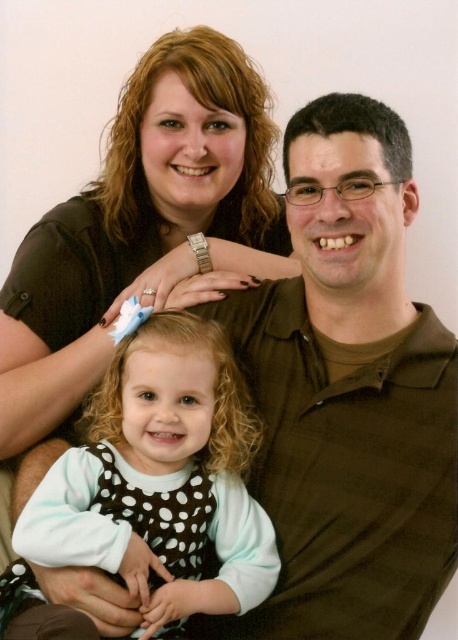
Looking at the image, which object is bigger between the matte black shirt at upper left and the white dotted dress at center?

The matte black shirt at upper left is larger in size compared to the white dotted dress at center according to the description.